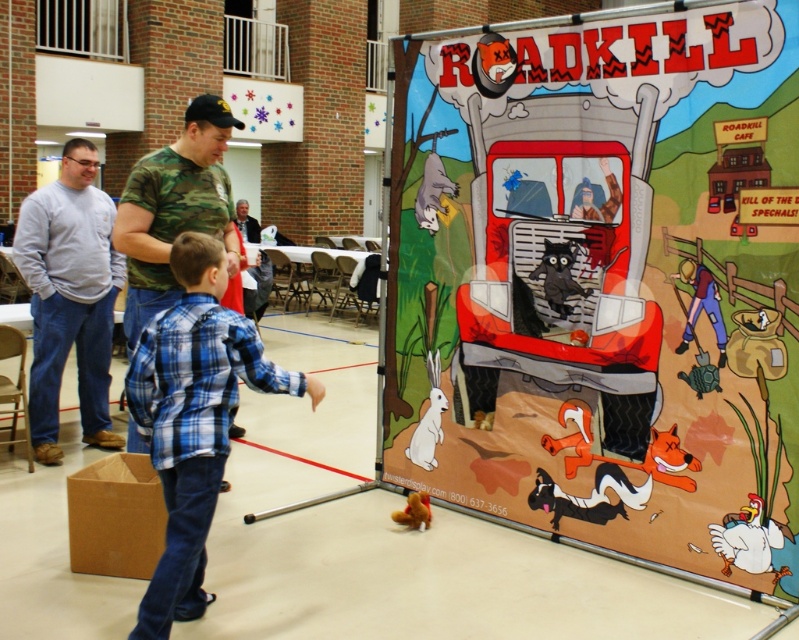
You are a photographer standing at the back of the room. You want to take a photo of the camo fabric shirt at center and the white matte chicken at lower right. Which object should you focus on first if you want to capture both in the same frame without moving the camera?

The camo fabric shirt at center should be focused on first because it is located above the white matte chicken at lower right, so adjusting focus to the shirt will naturally include the chicken in the lower part of the frame.

You are organizing a charity event and need to decide which item to place first in the display area. The camo fabric shirt at center and the white matte chicken at lower right both need to be displayed. Considering their sizes, which item should you place first to ensure proper spacing?

The camo fabric shirt at center has a larger size compared to the white matte chicken at lower right, so you should place the camo fabric shirt at center first to account for its larger size and ensure proper spacing.

You are organizing a community event and need to place a 1 meter long banner between the cartoonish paper truck at center and the white matte chicken at lower right. Is there enough space to fit the banner without moving either object?

The distance between the cartoonish paper truck at center and the white matte chicken at lower right is 89.94 centimeters. Since the banner is 1 meter long, which is 100 centimeters, there isn t enough space to fit the banner without moving either object.